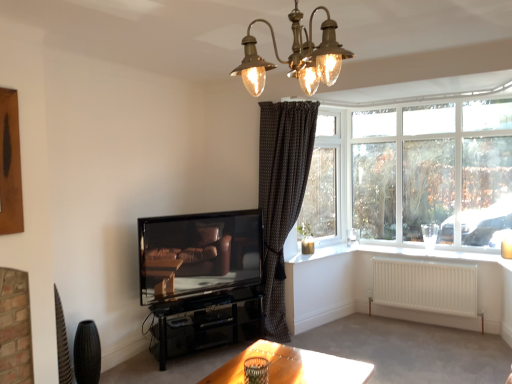
In order to click on free space above white painted wood at lower right (from a real-world perspective) in this screenshot , I will do `click(426, 256)`.